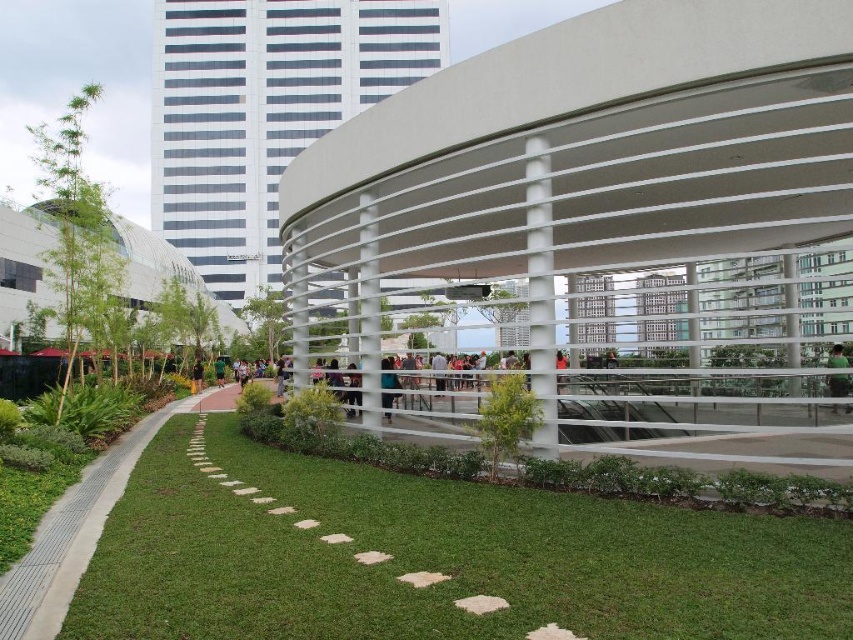
Question: Which of these objects is positioned closest to the green fabric shirt at center?

Choices:
 (A) black fabric person at lower left
 (B) green grass at lower center
 (C) green fabric at center

Answer: (A)

Question: Which point is closer to the camera taking this photo?

Choices:
 (A) (219, 369)
 (B) (558, 364)
 (C) (199, 364)

Answer: (B)

Question: Observing the image, what is the correct spatial positioning of green fabric at center in reference to black fabric person at lower left?

Choices:
 (A) below
 (B) above

Answer: (B)

Question: Estimate the real-world distances between objects in this image. Which object is farther from the green fabric at center?

Choices:
 (A) black fabric person at lower left
 (B) matte black person at center
 (C) green grass at lower center

Answer: (A)

Question: Is green grass at lower center above black fabric person at lower left?

Choices:
 (A) yes
 (B) no

Answer: (A)

Question: Can you confirm if green fabric at center is positioned below green fabric shirt at center?

Choices:
 (A) no
 (B) yes

Answer: (A)